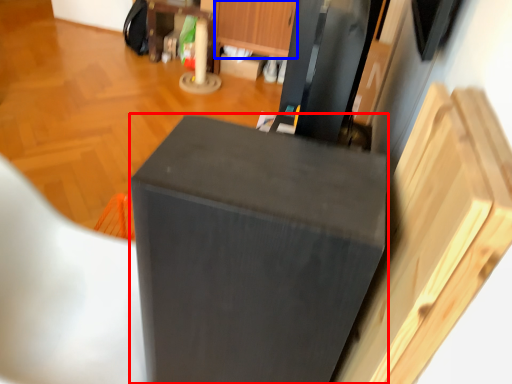
Question: Which object is further to the camera taking this photo, furniture (highlighted by a red box) or drawer (highlighted by a blue box)?

Choices:
 (A) furniture
 (B) drawer

Answer: (B)